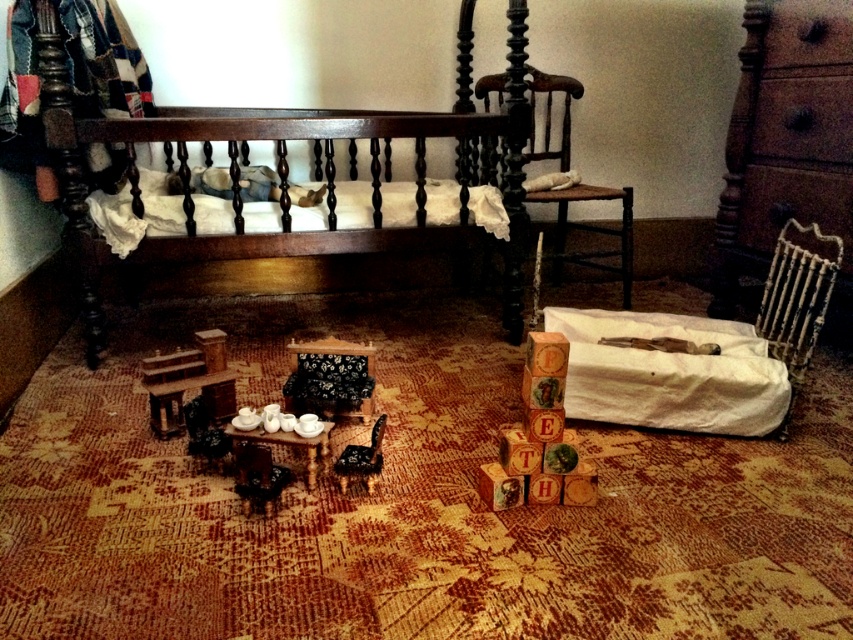
Between dark wood bed at upper left and wooden blocks at center, which one appears on the right side from the viewer's perspective?

From the viewer's perspective, wooden blocks at center appears more on the right side.

Can you confirm if dark wood bed at upper left is positioned to the left of wooden blocks at center?

Indeed, dark wood bed at upper left is positioned on the left side of wooden blocks at center.

Is point (78, 237) more distant than point (524, 433)?

Yes, it is.

Where is `dark wood bed at upper left`? dark wood bed at upper left is located at coordinates (279, 170).

Which of these two, dark brown wooden chair at center or wooden glossy chair at center, stands shorter?

Standing shorter between the two is wooden glossy chair at center.

Is dark brown wooden chair at center bigger than wooden glossy chair at center?

Yes, dark brown wooden chair at center is bigger than wooden glossy chair at center.

Image resolution: width=853 pixels, height=640 pixels. Describe the element at coordinates (590, 230) in the screenshot. I see `dark brown wooden chair at center` at that location.

This screenshot has width=853, height=640. Find the location of `dark brown wooden chair at center`. dark brown wooden chair at center is located at coordinates (590, 230).

Does point (532, 140) come behind point (318, 400)?

Yes, it is.

Does dark brown wooden chair at center lie in front of black floral fabric chair at center?

That is False.

I want to click on dark brown wooden chair at center, so click(x=590, y=230).

At what (x,y) coordinates should I click in order to perform the action: click on dark brown wooden chair at center. Please return your answer as a coordinate pair (x, y). Looking at the image, I should click on (590, 230).